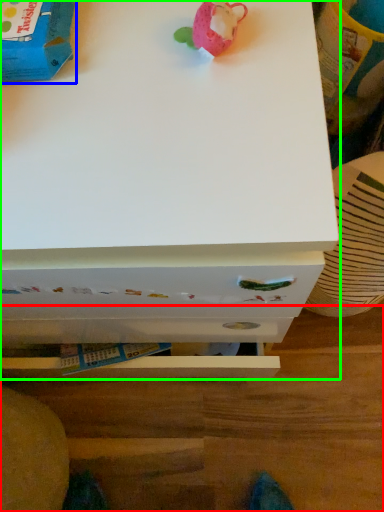
Question: Based on their relative distances, which object is nearer to table (highlighted by a red box)? Choose from toy (highlighted by a blue box) and chest of drawers (highlighted by a green box).

Choices:
 (A) toy
 (B) chest of drawers

Answer: (B)